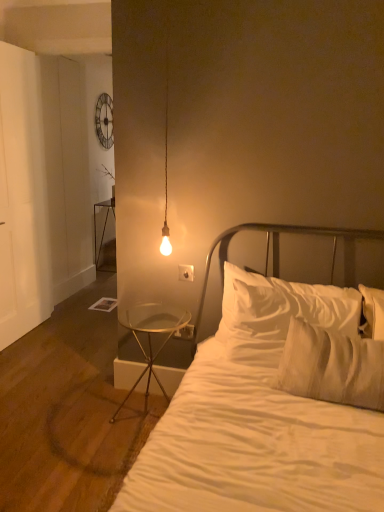
Question: Which direction should I rotate to face white plastic electric outlet at lower center, the 1th electric outlet ordered from the bottom, — up or down?

Choices:
 (A) down
 (B) up

Answer: (A)

Question: Does white soft pillow at center appear on the right side of white plastic electric outlet at center, the 1th electric outlet viewed from the front?

Choices:
 (A) yes
 (B) no

Answer: (A)

Question: Are white soft pillow at center and white plastic electric outlet at center, which is the second electric outlet from bottom to top, beside each other?

Choices:
 (A) no
 (B) yes

Answer: (A)

Question: Is white soft pillow at center not near white plastic electric outlet at center, which ranks as the 1th electric outlet in top-to-bottom order?

Choices:
 (A) yes
 (B) no

Answer: (B)

Question: From a real-world perspective, is white soft pillow at center positioned under white plastic electric outlet at center, which is the second electric outlet from back to front, based on gravity?

Choices:
 (A) yes
 (B) no

Answer: (A)

Question: Can you confirm if white soft pillow at center is bigger than white plastic electric outlet at center, which is the second electric outlet from bottom to top?

Choices:
 (A) yes
 (B) no

Answer: (A)

Question: Considering the relative sizes of white soft pillow at center and white plastic electric outlet at center, which is the second electric outlet from back to front, in the image provided, is white soft pillow at center thinner than white plastic electric outlet at center, which is the second electric outlet from back to front,?

Choices:
 (A) no
 (B) yes

Answer: (A)

Question: From the image's perspective, is white plastic electric outlet at lower center, which ranks as the 1th electric outlet in back-to-front order, above clear glass table at lower left, which ranks as the second nightstand in back-to-front order?

Choices:
 (A) yes
 (B) no

Answer: (A)

Question: From a real-world perspective, is white plastic electric outlet at lower center, placed as the second electric outlet when sorted from front to back, located beneath clear glass table at lower left, placed as the 1th nightstand when sorted from front to back?

Choices:
 (A) no
 (B) yes

Answer: (A)

Question: Does white plastic electric outlet at lower center, the 1th electric outlet ordered from the bottom, have a lesser width compared to clear glass table at lower left, which is the 1th nightstand from bottom to top?

Choices:
 (A) yes
 (B) no

Answer: (A)

Question: Is white plastic electric outlet at lower center, placed as the second electric outlet when sorted from front to back, bigger than clear glass table at lower left, which is the 1th nightstand from bottom to top?

Choices:
 (A) yes
 (B) no

Answer: (B)

Question: Does white plastic electric outlet at lower center, which is the second electric outlet in top-to-bottom order, have a greater height compared to clear glass table at lower left, placed as the 1th nightstand when sorted from front to back?

Choices:
 (A) yes
 (B) no

Answer: (B)

Question: From the image's perspective, is white plastic electric outlet at lower center, placed as the second electric outlet when sorted from front to back, below clear glass table at lower left, positioned as the 1th nightstand in right-to-left order?

Choices:
 (A) no
 (B) yes

Answer: (A)

Question: From a real-world perspective, is clear glass table at lower left, acting as the 2th nightstand starting from the left, under white soft pillow at center?

Choices:
 (A) no
 (B) yes

Answer: (B)